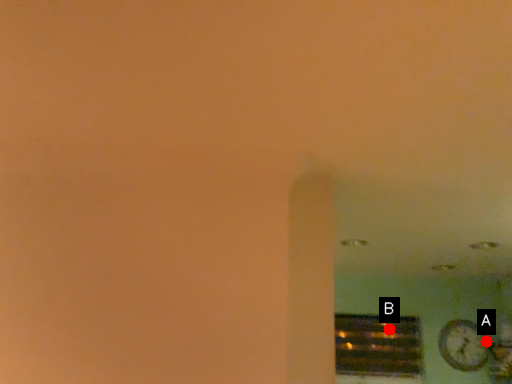
Question: Two points are circled on the image, labeled by A and B beside each circle. Among these points, which one is farthest from the camera?

Choices:
 (A) A is further
 (B) B is further

Answer: (B)